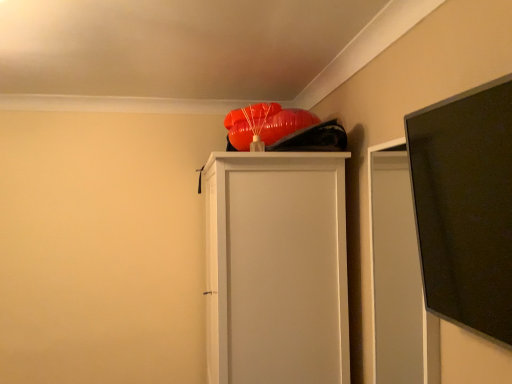
The width and height of the screenshot is (512, 384). What do you see at coordinates (264, 124) in the screenshot?
I see `orange matte balloon at upper center` at bounding box center [264, 124].

What is the approximate height of orange matte balloon at upper center?

9.68 inches.

Find the location of a particular element. Image resolution: width=512 pixels, height=384 pixels. orange matte balloon at upper center is located at coordinates (264, 124).

Locate an element on the screen. This screenshot has height=384, width=512. orange matte balloon at upper center is located at coordinates (264, 124).